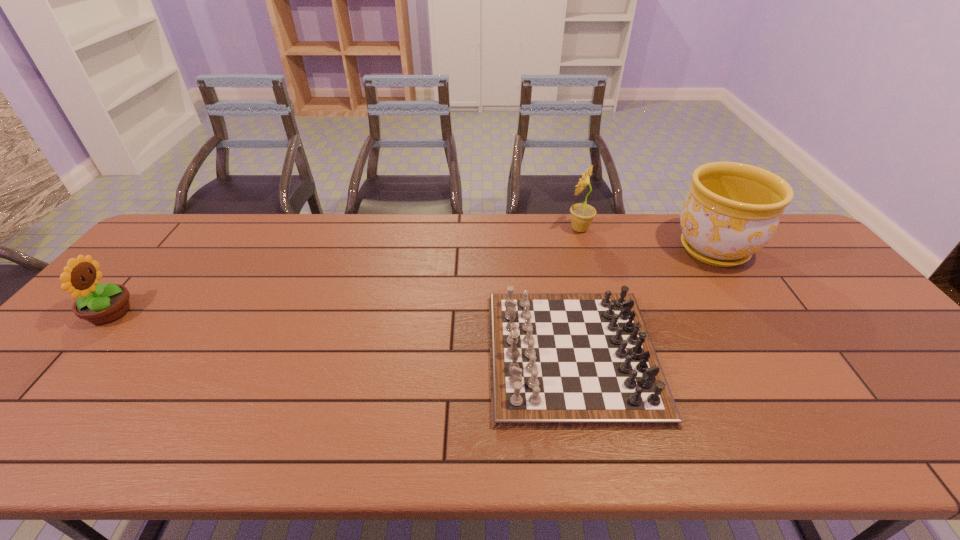
The height and width of the screenshot is (540, 960). Identify the location of the rightmost object. (732, 210).

The image size is (960, 540). In order to click on the right sunflower in this screenshot , I will do `click(582, 215)`.

You are a GUI agent. You are given a task and a screenshot of the screen. Output one action in this format:
    pyautogui.click(x=<x>, y=<y>)
    Task: Click on the taller sunflower
    
    Given the screenshot: What is the action you would take?
    pyautogui.click(x=582, y=215)

Identify the location of the third tallest object. (100, 304).

Where is `the nearer sunflower`? the nearer sunflower is located at coordinates click(100, 304).

This screenshot has height=540, width=960. In order to click on chessboard in this screenshot , I will do `click(558, 361)`.

Where is `vacant point located 0.300m on the front of the rightmost object`? This screenshot has height=540, width=960. vacant point located 0.300m on the front of the rightmost object is located at coordinates (783, 356).

Where is `free space located 0.050m on the face of the farther sunflower`? free space located 0.050m on the face of the farther sunflower is located at coordinates (551, 229).

I want to click on blank area located on the face of the farther sunflower, so point(490,229).

Where is `blank space located 0.170m on the face of the farther sunflower`? This screenshot has height=540, width=960. blank space located 0.170m on the face of the farther sunflower is located at coordinates (516, 229).